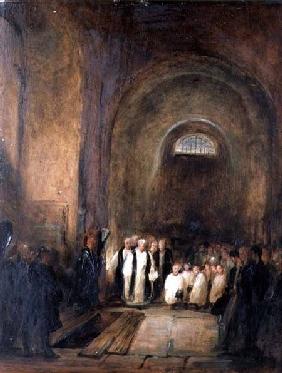
Where is `archway above door`? The height and width of the screenshot is (373, 282). archway above door is located at coordinates (197, 118).